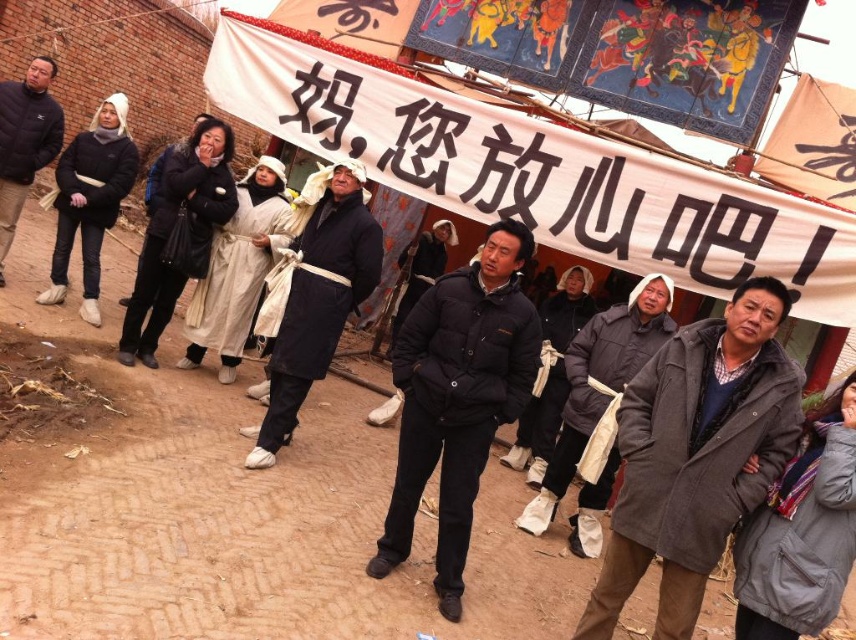
You are standing in the rural area and want to take a photo of the point at coordinates point [646,472]. If your camera has a maximum focus range of 10 feet, will you be able to capture the point clearly?

The point [646,472] is 11.34 feet away from the camera, which exceeds the maximum focus range of 10 feet. Therefore, the camera will not be able to capture the point clearly.

You are a photographer trying to capture a group photo of the scene. You need to ensure that both the dark blue fabric coat at center and the black matte coat at center are fully visible in the frame. Given their sizes, which coat might require you to adjust your camera angle to ensure it fits in the shot?

The dark blue fabric coat at center has a larger width than the black matte coat at center, so it might require adjusting the camera angle to ensure it fits in the shot.

In the scene shown: You are a photographer positioned at the origin of the coordinate system. You need to capture a photo of the gray woolen coat at center. What are the coordinates where you should aim your camera?

The coordinates to aim your camera are at point (696, 456), where the gray woolen coat at center is located.